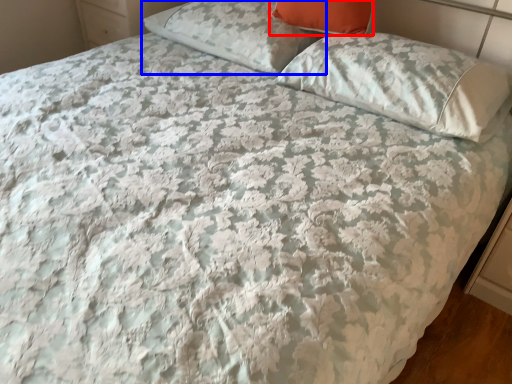
Question: Which object appears farthest to the camera in this image, pillow (highlighted by a red box) or pillow (highlighted by a blue box)?

Choices:
 (A) pillow
 (B) pillow

Answer: (B)